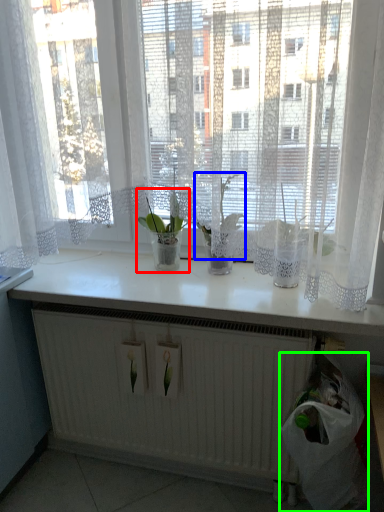
Question: Which object is positioned farthest from houseplant (highlighted by a red box)? Select from orchid (highlighted by a blue box) and garbage (highlighted by a green box).

Choices:
 (A) orchid
 (B) garbage

Answer: (B)